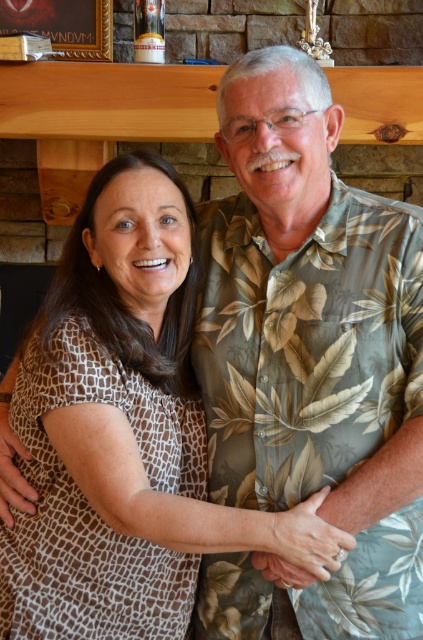
Question: Does brown textured blouse at center appear on the right side of wooden picture frame at upper center?

Choices:
 (A) no
 (B) yes

Answer: (B)

Question: Does brown textured blouse at center appear on the right side of wooden picture frame at upper center?

Choices:
 (A) yes
 (B) no

Answer: (A)

Question: Among these points, which one is nearest to the camera?

Choices:
 (A) (60, 32)
 (B) (172, 509)

Answer: (B)

Question: Can you confirm if brown textured blouse at center is positioned to the left of wooden picture frame at upper center?

Choices:
 (A) no
 (B) yes

Answer: (A)